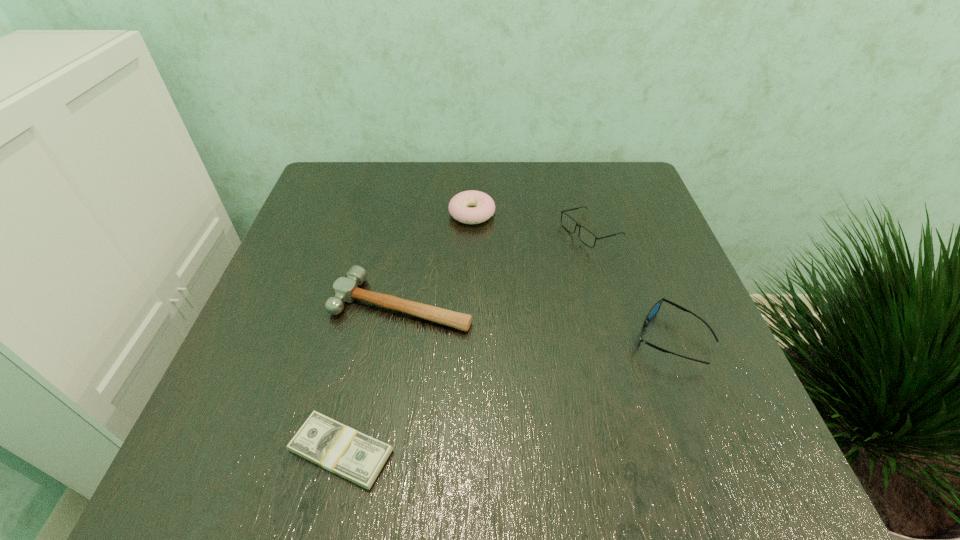
Where is `vacant space at the far right corner of the desktop`? The width and height of the screenshot is (960, 540). vacant space at the far right corner of the desktop is located at coordinates (620, 166).

Locate an element on the screen. vacant area that lies between the sunglasses and the tallest object is located at coordinates (631, 286).

The image size is (960, 540). Identify the location of vacant space that is in between the doughnut and the sunglasses. (571, 276).

I want to click on empty location between the hammer and the tallest object, so click(x=496, y=268).

This screenshot has width=960, height=540. I want to click on free point between the sunglasses and the tallest object, so click(x=631, y=286).

At what (x,y) coordinates should I click in order to perform the action: click on free space that is in between the dollar and the doughnut. Please return your answer as a coordinate pair (x, y). The height and width of the screenshot is (540, 960). Looking at the image, I should click on (407, 332).

Locate an element on the screen. free space between the hammer and the doughnut is located at coordinates (437, 259).

The width and height of the screenshot is (960, 540). I want to click on unoccupied area between the doughnut and the hammer, so click(x=437, y=259).

I want to click on free point between the hammer and the dollar, so click(372, 377).

Locate an element on the screen. The image size is (960, 540). free space between the hammer and the doughnut is located at coordinates [437, 259].